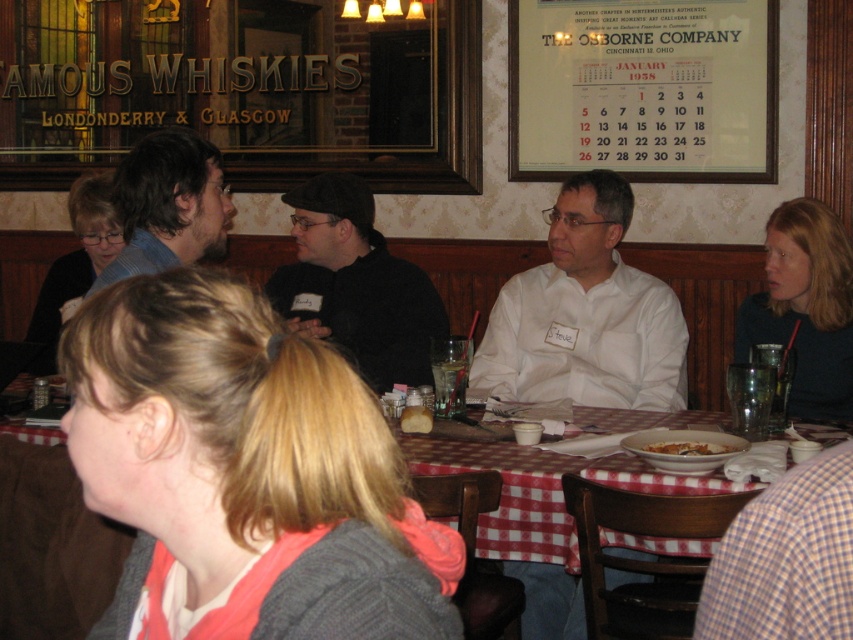
Question: Is matte black sweater at left positioned in front of white creamy soup at center?

Choices:
 (A) yes
 (B) no

Answer: (B)

Question: Which point appears farthest from the camera in this image?

Choices:
 (A) (679, 346)
 (B) (514, 541)

Answer: (A)

Question: In this image, where is black matte shirt at center located relative to matte black sweater at left?

Choices:
 (A) left
 (B) right

Answer: (B)

Question: Which point is farther to the camera?

Choices:
 (A) white matte bowl at center
 (B) dark blue sweater at right
 (C) dark brown hair at center

Answer: (B)

Question: Does blonde hair at center appear over white matte bowl at center?

Choices:
 (A) yes
 (B) no

Answer: (A)

Question: Which object is positioned farthest from the white shirt at center?

Choices:
 (A) red checkered tablecloth at center
 (B) blonde hair at center
 (C) dark brown hair at center
 (D) matte black sweater at left

Answer: (B)